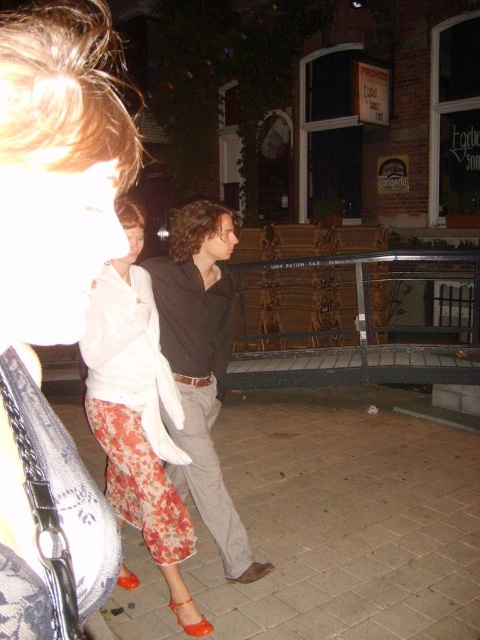
You are standing at the center of the plaza and see the point marked at coordinates (54, 305). What object is located at that point?

The point at coordinates (54, 305) marks the location of the floral fabric pants at lower left.

You are standing at the camera position and want to throw a small object to the nearest point between point (110, 470) and point (225, 273). Which point should you aim for?

Point (110, 470) is closer to the camera than point (225, 273), so you should aim for point (110, 470) since it is the nearest point.

You are standing at the center of the image and want to move towards the floral fabric pants at lower left. What direction should you move in?

Since the floral fabric pants at lower left are located at point 0.477 on the x axis and 0.113 on the y axis, you should move towards the lower left direction to reach them.